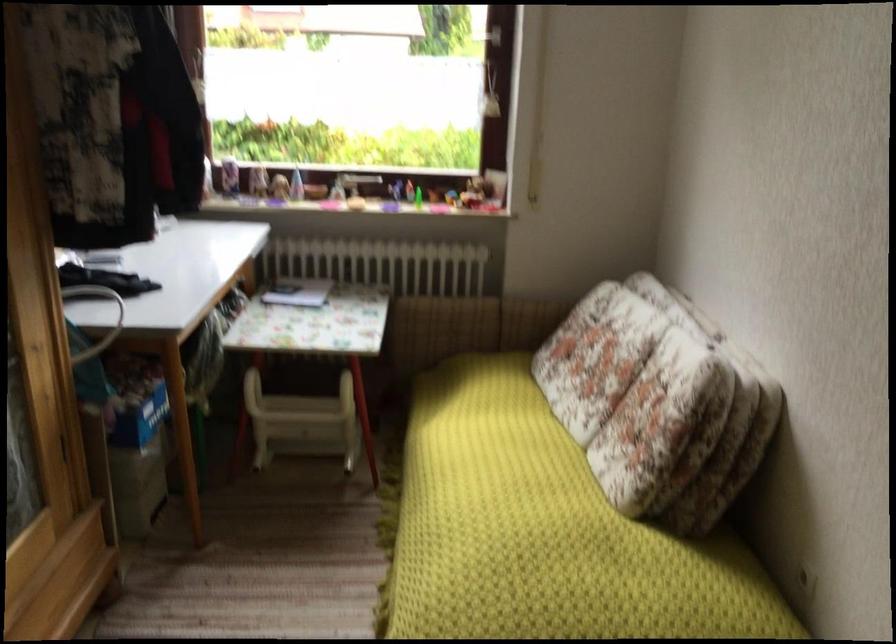
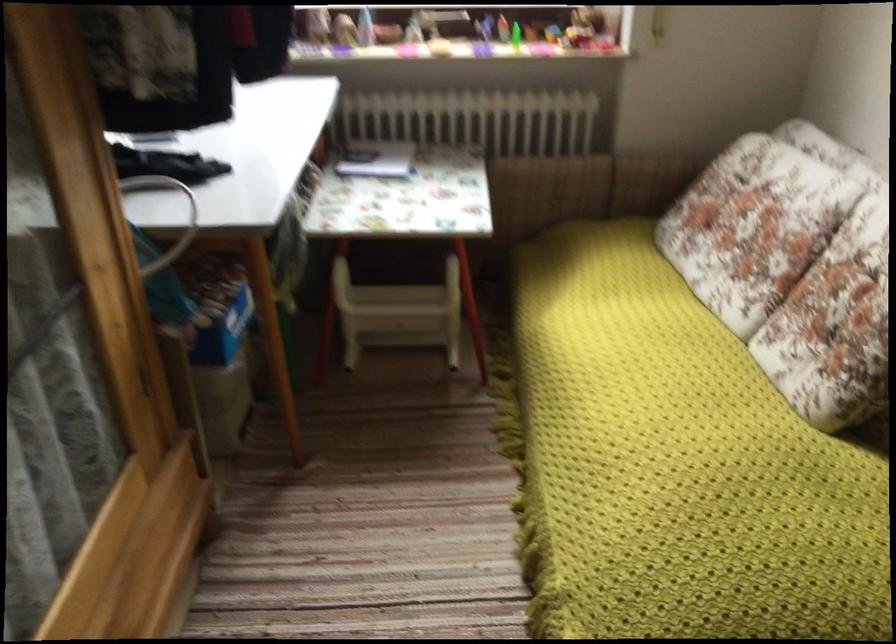
Question: How did the camera likely rotate?

Choices:
 (A) Left
 (B) Right
 (C) Up
 (D) Down

Answer: (D)